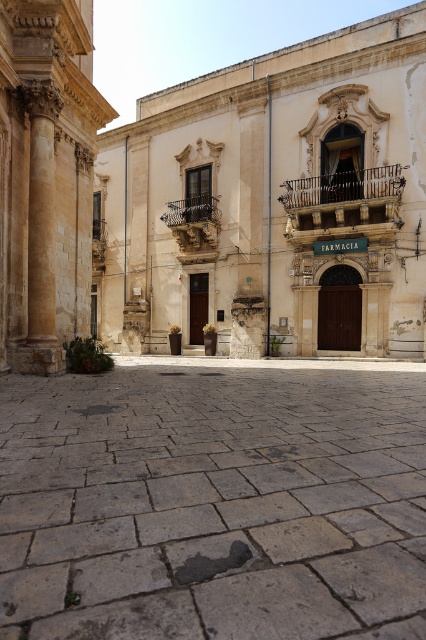
Question: Which object appears farthest from the camera in this image?

Choices:
 (A) golden stone column at left
 (B) gray stone plaza at center

Answer: (A)

Question: Can you confirm if gray stone plaza at center is positioned below golden stone column at left?

Choices:
 (A) no
 (B) yes

Answer: (B)

Question: Among these points, which one is nearest to the camera?

Choices:
 (A) (2, 324)
 (B) (207, 516)

Answer: (B)

Question: Which of the following is the closest to the observer?

Choices:
 (A) (291, 426)
 (B) (37, 93)

Answer: (A)

Question: Can you confirm if gray stone plaza at center is bigger than golden stone column at left?

Choices:
 (A) yes
 (B) no

Answer: (B)

Question: Does gray stone plaza at center appear on the left side of golden stone column at left?

Choices:
 (A) yes
 (B) no

Answer: (B)